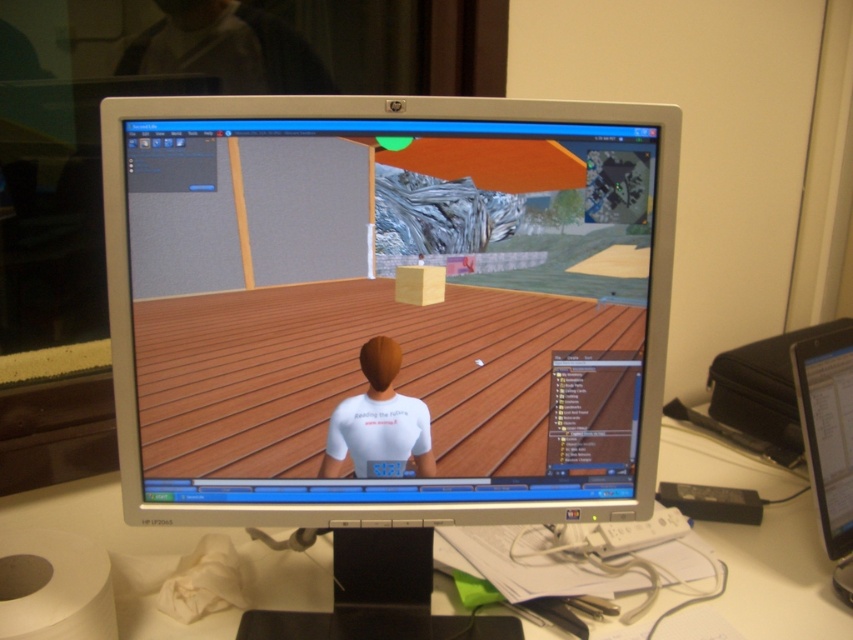
You are sitting in front of a desk with a black plastic monitor at right. You want to reach for a pen that is on the desk near the monitor. Considering your arm can comfortably reach 36 inches, can you comfortably reach the pen?

The black plastic monitor at right and viewer are 37.68 inches apart from each other. Since your arm can reach 36 inches, you cannot comfortably reach the pen as it is slightly farther away than your arm can comfortably extend.

From the picture: You are a graphic designer working on a project and need to place a new element on your computer screen. The screen has a black plastic monitor at right. Where should you place the new element to ensure it aligns with the existing layout?

The black plastic monitor at right is located at point (x=828, y=440), so place the new element near that coordinate to maintain alignment with the existing layout.